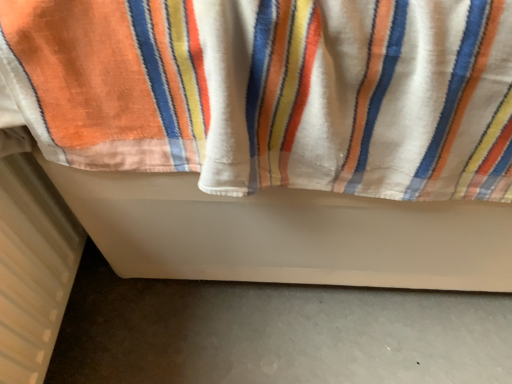
Question: Looking at their shapes, would you say white soft towel at center is wider or thinner than white textured radiator at lower left?

Choices:
 (A) thin
 (B) wide

Answer: (B)

Question: Considering the positions of white soft towel at center and white textured radiator at lower left in the image, is white soft towel at center taller or shorter than white textured radiator at lower left?

Choices:
 (A) tall
 (B) short

Answer: (A)

Question: Would you say white soft towel at center is to the left or to the right of white textured radiator at lower left in the picture?

Choices:
 (A) right
 (B) left

Answer: (A)

Question: In the image, is white textured radiator at lower left positioned in front of or behind white soft towel at center?

Choices:
 (A) behind
 (B) front

Answer: (A)

Question: Considering the relative positions of white textured radiator at lower left and white soft towel at center in the image provided, is white textured radiator at lower left to the left or to the right of white soft towel at center?

Choices:
 (A) right
 (B) left

Answer: (B)

Question: Is white textured radiator at lower left bigger or smaller than white soft towel at center?

Choices:
 (A) big
 (B) small

Answer: (B)

Question: From a real-world perspective, is white textured radiator at lower left above or below white soft towel at center?

Choices:
 (A) below
 (B) above

Answer: (A)